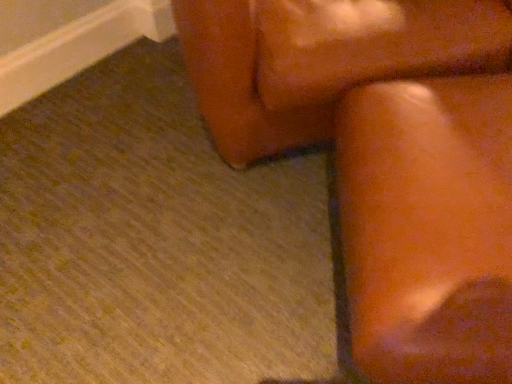
Question: In terms of height, does leather couch at upper right, the second furniture positioned from the bottom, look taller or shorter compared to matte brown couch at right, positioned as the second furniture in top-to-bottom order?

Choices:
 (A) short
 (B) tall

Answer: (B)

Question: Relative to matte brown couch at right, which is counted as the first furniture, starting from the bottom, is leather couch at upper right, which is counted as the first furniture, starting from the top, in front or behind?

Choices:
 (A) front
 (B) behind

Answer: (B)

Question: Considering the real-world distances, which object is closest to the matte brown couch at right, which is counted as the first furniture, starting from the bottom?

Choices:
 (A) brown leather rocking chair at upper right
 (B) leather couch at upper right, which is counted as the first furniture, starting from the top

Answer: (A)

Question: Estimate the real-world distances between objects in this image. Which object is closer to the brown leather rocking chair at upper right?

Choices:
 (A) leather couch at upper right, the second furniture positioned from the bottom
 (B) matte brown couch at right, which is counted as the first furniture, starting from the bottom

Answer: (B)